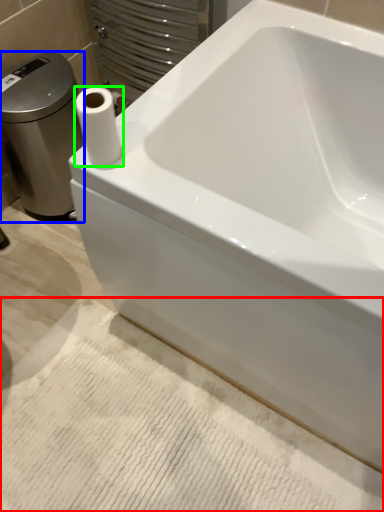
Question: Estimate the real-world distances between objects in this image. Which object is closer to bath mat (highlighted by a red box), porcelain (highlighted by a blue box) or paper towel (highlighted by a green box)?

Choices:
 (A) porcelain
 (B) paper towel

Answer: (B)